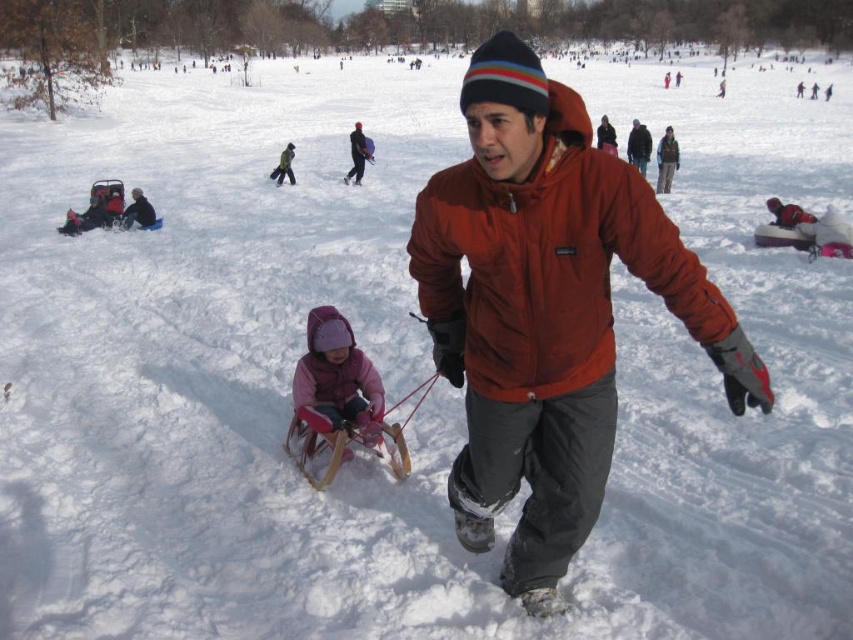
Question: Does dark brown leather jacket at upper center have a smaller size compared to matte black jacket at center?

Choices:
 (A) yes
 (B) no

Answer: (B)

Question: Does dark blue snowsuit at left have a lesser width compared to brushed metal snowsuit at center?

Choices:
 (A) yes
 (B) no

Answer: (B)

Question: Which object is positioned closest to the dark gray woolen hat at upper center?

Choices:
 (A) orange fleece jacket at center
 (B) dark blue snowsuit at left
 (C) pink fleece jacket at center
 (D) dark brown leather jacket at upper center

Answer: (D)

Question: Estimate the real-world distances between objects in this image. Which object is closer to the dark blue snowsuit at left?

Choices:
 (A) matte black sled at left
 (B) dark brown leather jacket at upper center
 (C) dark gray woolen hat at upper center

Answer: (A)

Question: Can you confirm if pink fleece jacket at center is thinner than brushed metal snowsuit at center?

Choices:
 (A) yes
 (B) no

Answer: (B)

Question: Which point appears closest to the camera in this image?

Choices:
 (A) pos(361,150)
 (B) pos(606,134)
 (C) pos(323,321)
 (D) pos(631,145)

Answer: (C)